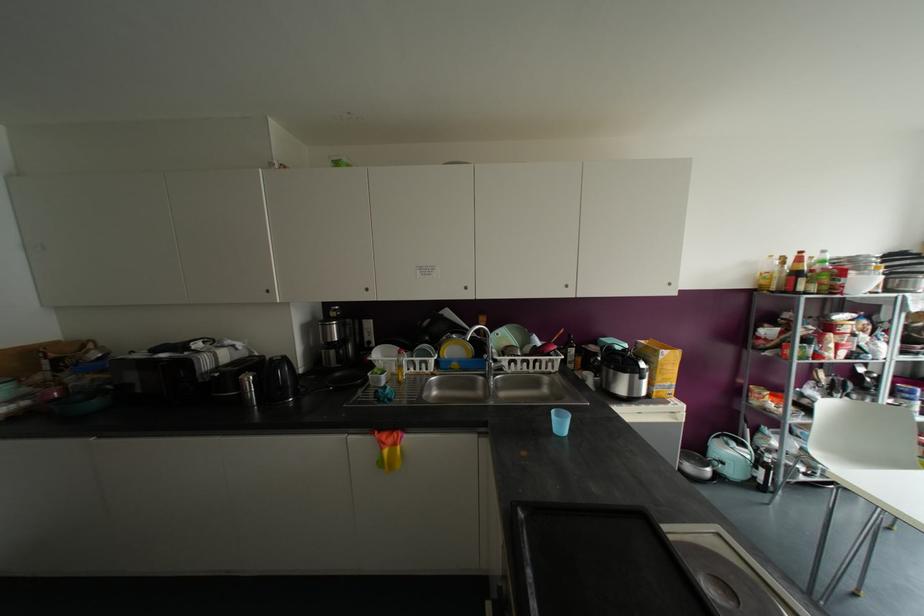
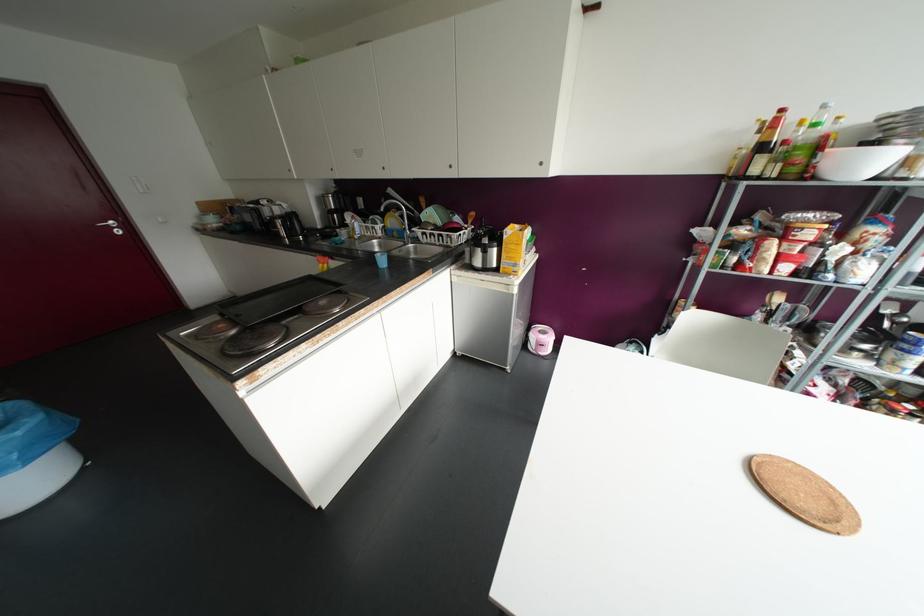
Find the pixel in the second image that matches point 504,359 in the first image.

(417, 231)